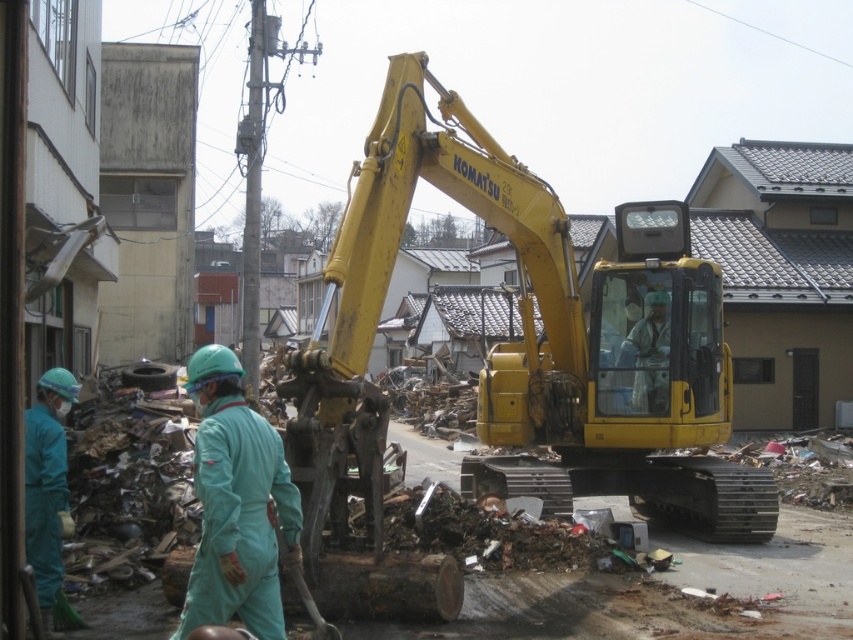
Which is below, teal fabric jumpsuit at center or teal fabric uniform at left?

teal fabric uniform at left is lower down.

Does teal fabric jumpsuit at center have a lesser height compared to teal fabric uniform at left?

Yes.

Between point (280, 515) and point (70, 614), which one is positioned in front?

Point (280, 515)

This screenshot has width=853, height=640. What are the coordinates of `teal fabric jumpsuit at center` in the screenshot? It's located at (236, 502).

Where is `yellow metallic excavator at center`? yellow metallic excavator at center is located at coordinates (525, 342).

The width and height of the screenshot is (853, 640). Describe the element at coordinates (525, 342) in the screenshot. I see `yellow metallic excavator at center` at that location.

Which is behind, point (508, 419) or point (33, 467)?

Point (508, 419)

Find the location of a particular element. Image resolution: width=853 pixels, height=640 pixels. yellow metallic excavator at center is located at coordinates (525, 342).

Can you confirm if yellow metallic excavator at center is positioned above light blue fabric at center?

No.

Describe the element at coordinates (525, 342) in the screenshot. This screenshot has height=640, width=853. I see `yellow metallic excavator at center` at that location.

Is point (521, 417) positioned after point (663, 336)?

Yes.

The width and height of the screenshot is (853, 640). Find the location of `yellow metallic excavator at center`. yellow metallic excavator at center is located at coordinates (525, 342).